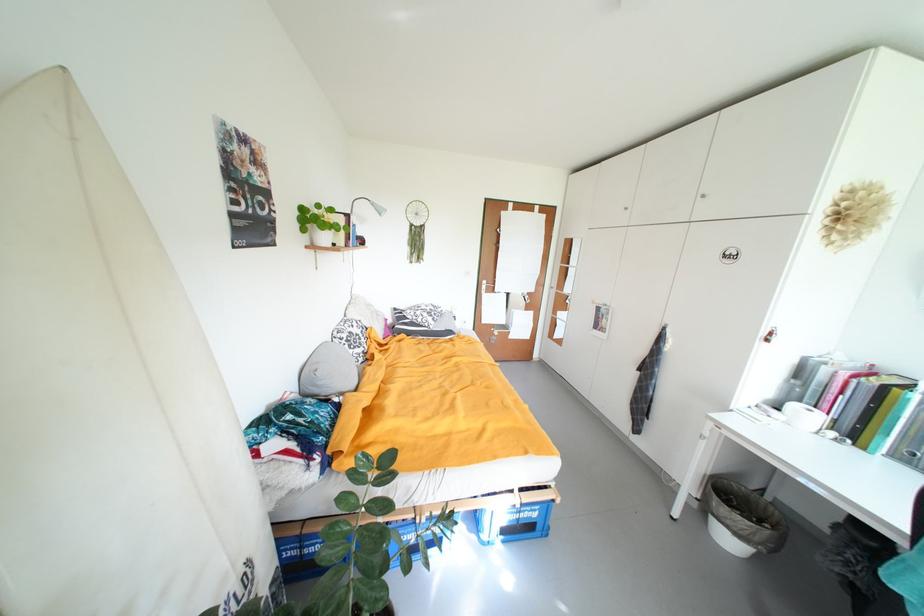
Locate an element on the screen. This screenshot has height=616, width=924. patterned pillow is located at coordinates (423, 321).